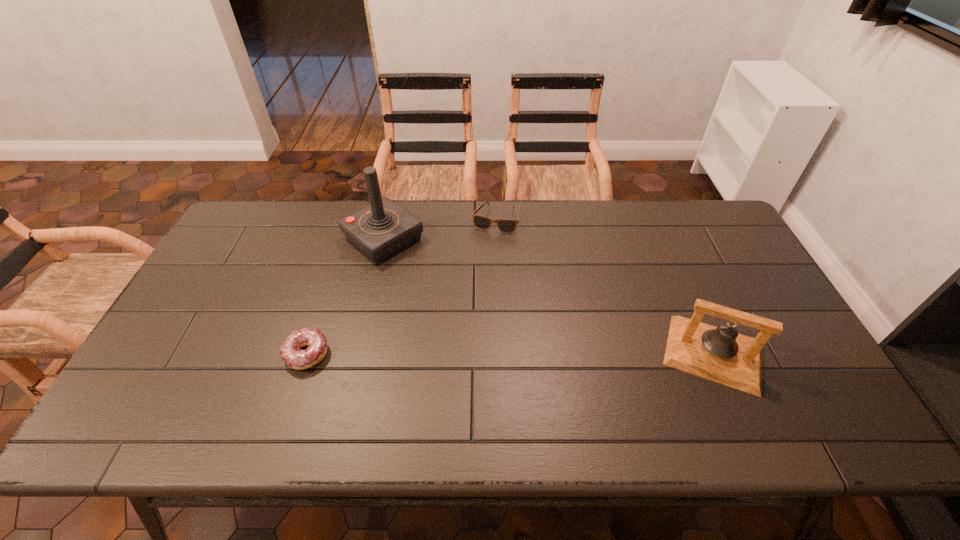
Image resolution: width=960 pixels, height=540 pixels. Identify the location of doughnut. (297, 359).

The width and height of the screenshot is (960, 540). Find the location of `bell`. bell is located at coordinates (720, 354).

Locate an element on the screen. The height and width of the screenshot is (540, 960). the rightmost object is located at coordinates (720, 354).

Locate an element on the screen. The image size is (960, 540). the third object from left to right is located at coordinates (481, 222).

The image size is (960, 540). Find the location of `the tallest object`. the tallest object is located at coordinates tap(383, 228).

Identify the location of blank space located 0.220m on the left of the doughnut. (199, 354).

Find the location of a particular element. Image resolution: width=960 pixels, height=540 pixels. blank area located on the back of the bell is located at coordinates (673, 261).

This screenshot has width=960, height=540. What are the coordinates of `vacant space located 0.340m on the frames of the sunglasses` in the screenshot? It's located at (466, 310).

Identify the location of vacant space located on the frames of the sunglasses. This screenshot has height=540, width=960. 479,266.

This screenshot has width=960, height=540. In order to click on free spot located 0.150m on the frames of the sunglasses in this screenshot , I will do `click(480, 264)`.